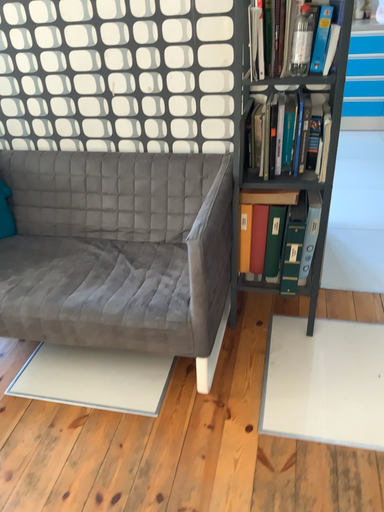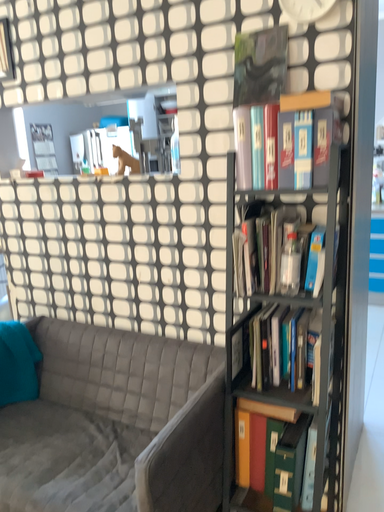
Question: Which way did the camera rotate in the video?

Choices:
 (A) rotated right
 (B) rotated left

Answer: (B)